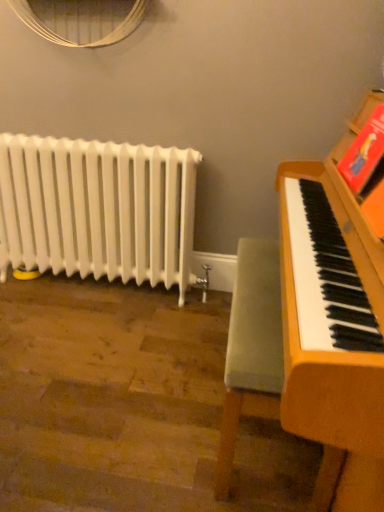
Question: Is velvet green armchair at right situated inside white glossy radiator at left or outside?

Choices:
 (A) inside
 (B) outside

Answer: (B)

Question: Considering their positions, is velvet green armchair at right located in front of or behind white glossy radiator at left?

Choices:
 (A) front
 (B) behind

Answer: (A)

Question: Looking at the image, does velvet green armchair at right seem bigger or smaller compared to white glossy radiator at left?

Choices:
 (A) big
 (B) small

Answer: (B)

Question: Is white glossy radiator at left in front of or behind velvet green armchair at right in the image?

Choices:
 (A) front
 (B) behind

Answer: (B)

Question: Is point (163, 225) positioned closer to the camera than point (337, 466)?

Choices:
 (A) farther
 (B) closer

Answer: (A)

Question: Considering the relative positions of white glossy radiator at left and velvet green armchair at right in the image provided, is white glossy radiator at left to the left or to the right of velvet green armchair at right?

Choices:
 (A) left
 (B) right

Answer: (A)

Question: From the image's perspective, is white glossy radiator at left located above or below velvet green armchair at right?

Choices:
 (A) below
 (B) above

Answer: (B)